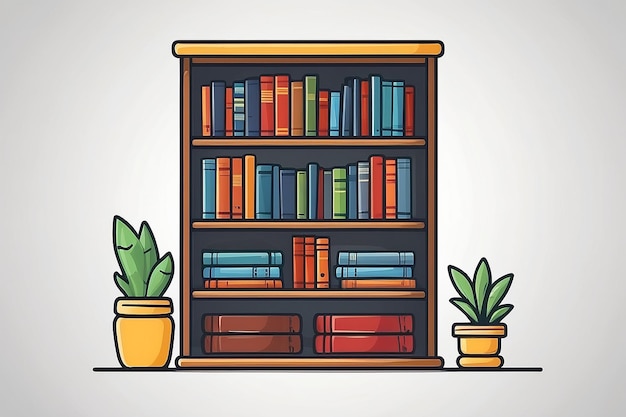
Locate an element on the screen. books on third shelf is located at coordinates (387, 287), (384, 273), (384, 258), (325, 273), (305, 284), (298, 273), (254, 257), (249, 271), (245, 284).